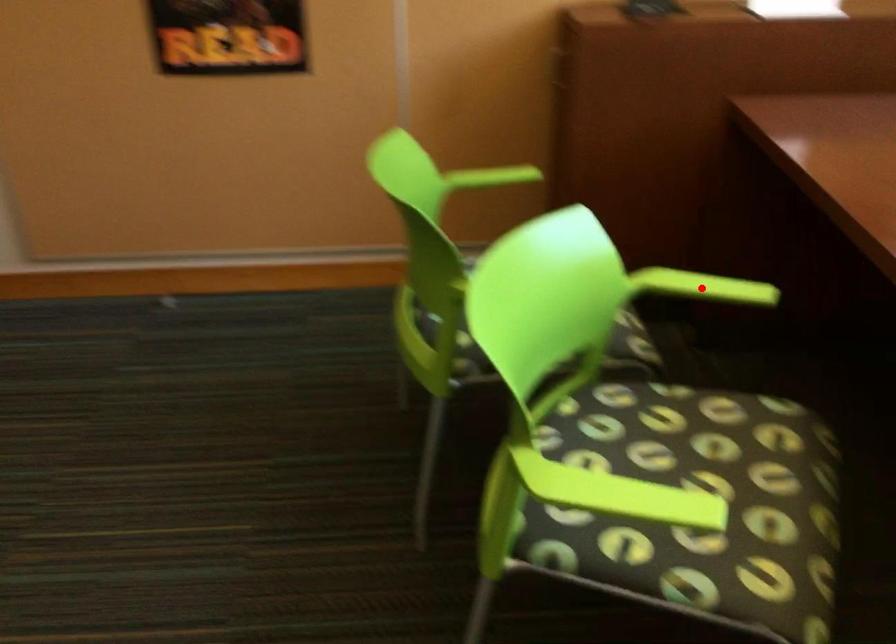
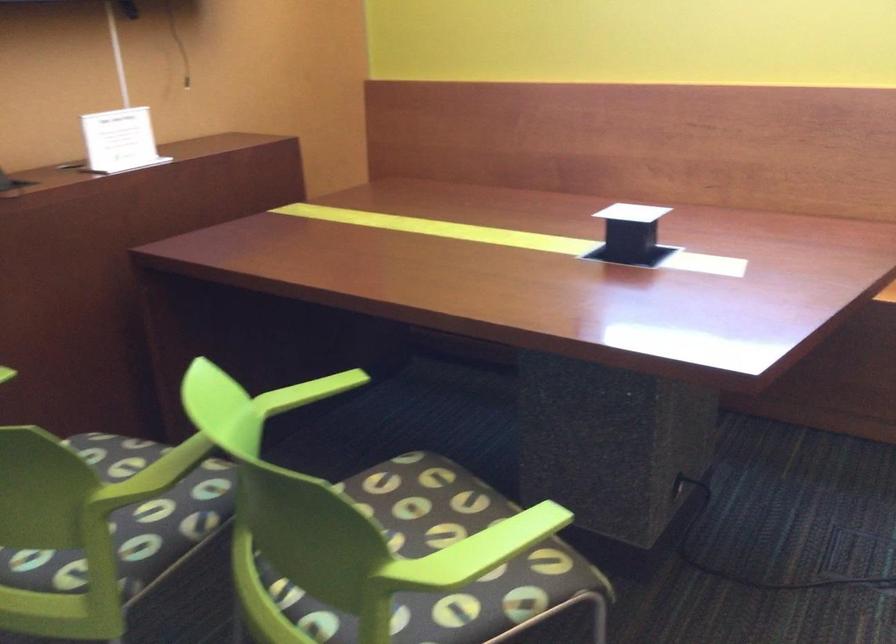
Where in the second image is the point corresponding to the highlighted location from the first image?

(307, 392)